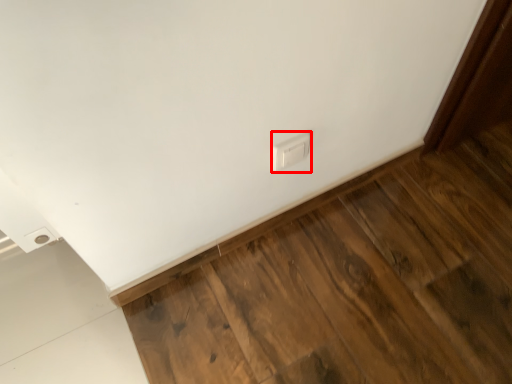
Question: From the image's perspective, where is electric outlet (annotated by the red box) located in relation to hardwood in the image?

Choices:
 (A) above
 (B) below

Answer: (A)